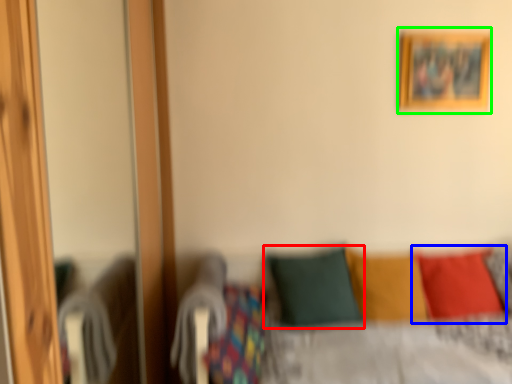
Question: Which is farther away from pillow (highlighted by a red box)? pillow (highlighted by a blue box) or picture frame (highlighted by a green box)?

Choices:
 (A) pillow
 (B) picture frame

Answer: (B)